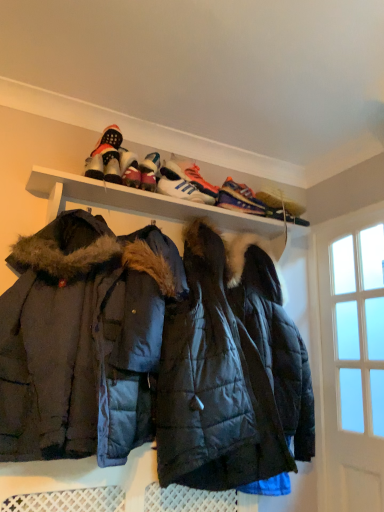
Question: Does white leather sneakers at upper center, the third footwear positioned from the right, turn towards shiny black sneakers at upper center, the fifth footwear when ordered from left to right?

Choices:
 (A) yes
 (B) no

Answer: (B)

Question: Is white leather sneakers at upper center, the 3th footwear when ordered from left to right, in contact with shiny black sneakers at upper center, marked as the 1th footwear in a right-to-left arrangement?

Choices:
 (A) no
 (B) yes

Answer: (A)

Question: Does white leather sneakers at upper center, the third footwear positioned from the right, have a greater width compared to shiny black sneakers at upper center, the fifth footwear when ordered from left to right?

Choices:
 (A) no
 (B) yes

Answer: (A)

Question: Can you confirm if white leather sneakers at upper center, the third footwear positioned from the right, is shorter than shiny black sneakers at upper center, marked as the 1th footwear in a right-to-left arrangement?

Choices:
 (A) yes
 (B) no

Answer: (B)

Question: Does white leather sneakers at upper center, the 3th footwear when ordered from left to right, have a smaller size compared to shiny black sneakers at upper center, marked as the 1th footwear in a right-to-left arrangement?

Choices:
 (A) yes
 (B) no

Answer: (B)

Question: Is dark blue quilted jacket at center inside or outside of shiny black sneakers at upper center, marked as the 1th footwear in a right-to-left arrangement?

Choices:
 (A) inside
 (B) outside

Answer: (B)

Question: From the image's perspective, is dark blue quilted jacket at center above or below shiny black sneakers at upper center, the fifth footwear when ordered from left to right?

Choices:
 (A) above
 (B) below

Answer: (B)

Question: From a real-world perspective, is dark blue quilted jacket at center positioned above or below shiny black sneakers at upper center, the fifth footwear when ordered from left to right?

Choices:
 (A) below
 (B) above

Answer: (A)

Question: Is dark blue quilted jacket at center in front of or behind shiny black sneakers at upper center, the fifth footwear when ordered from left to right, in the image?

Choices:
 (A) behind
 (B) front

Answer: (B)

Question: Does point (137, 177) appear closer or farther from the camera than point (198, 192)?

Choices:
 (A) closer
 (B) farther

Answer: (A)

Question: Is white leather sneakers at upper center, the 2th footwear viewed from the left, bigger or smaller than white leather sneakers at upper center, the 3th footwear when ordered from left to right?

Choices:
 (A) big
 (B) small

Answer: (B)

Question: From a real-world perspective, is white leather sneakers at upper center, the 2th footwear viewed from the left, positioned above or below white leather sneakers at upper center, the 3th footwear when ordered from left to right?

Choices:
 (A) below
 (B) above

Answer: (A)

Question: From their relative heights in the image, would you say white leather sneakers at upper center, arranged as the fourth footwear when viewed from the right, is taller or shorter than white leather sneakers at upper center, the third footwear positioned from the right?

Choices:
 (A) tall
 (B) short

Answer: (B)

Question: Does point (124, 179) appear closer or farther from the camera than point (139, 189)?

Choices:
 (A) farther
 (B) closer

Answer: (B)

Question: In terms of width, does white leather sneakers at upper center, the 2th footwear viewed from the left, look wider or thinner when compared to white matte shelf at upper center?

Choices:
 (A) wide
 (B) thin

Answer: (B)